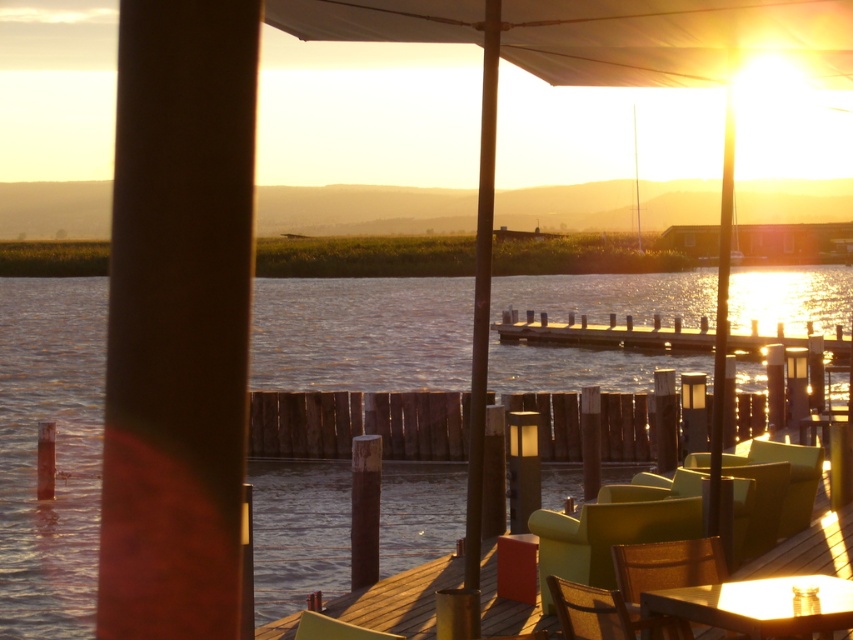
Question: Which is nearer to the matte green chair at lower center?

Choices:
 (A) matte green chair at lower right
 (B) matte yellow chair at lower right
 (C) wooden textured chair at lower right

Answer: (C)

Question: Which of the following is the closest to the observer?

Choices:
 (A) matte wooden table at lower right
 (B) shiny blue water at center
 (C) wooden textured chair at lower right
 (D) matte yellow chair at lower right

Answer: (A)

Question: Is matte yellow chair at lower right closer to camera compared to matte green chair at lower center?

Choices:
 (A) no
 (B) yes

Answer: (A)

Question: Among these objects, which one is nearest to the camera?

Choices:
 (A) matte green chair at lower right
 (B) shiny blue water at center

Answer: (A)

Question: Is shiny blue water at center smaller than wooden textured chair at lower right?

Choices:
 (A) yes
 (B) no

Answer: (B)

Question: Is matte green chair at lower right smaller than matte yellow chair at lower right?

Choices:
 (A) no
 (B) yes

Answer: (B)